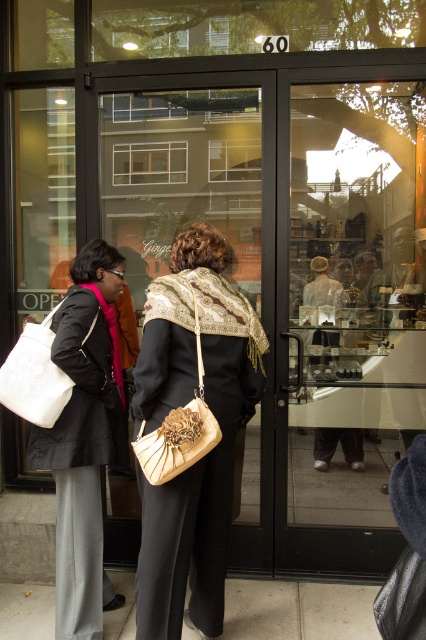
You are trying to enter the shop and need to locate the transparent glass door at center and the gold textured purse at center. Based on their positions, which object is closer to the ground?

The gold textured purse at center is closer to the ground because the transparent glass door at center is located above it.

You are a delivery person who needs to hand over two packages to the people in the image. The first package is for the person holding the white woven tote at left, and the second is for the person holding the gold textured purse at center. Based on their positions, which person should you approach first if you want to deliver both packages efficiently?

You should approach the person holding the white woven tote at left first because the gold textured purse at center is behind it, meaning the person with the gold purse is further back. Delivering to the front person first allows you to then move backward to reach the second person efficiently.

You are trying to decide which bag to choose based on height. The white woven tote at left and the gold textured purse at center are both in view. Which one is taller?

The gold textured purse at center is taller than the white woven tote at left.